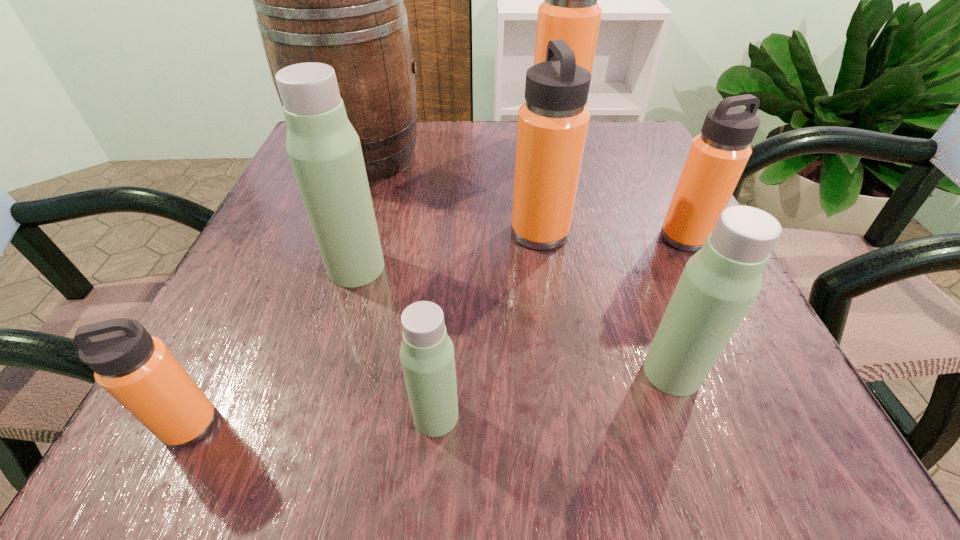
In the image, there is a desktop. At what (x,y) coordinates should I click in order to perform the action: click on free space at the right edge. Please return your answer as a coordinate pair (x, y). The width and height of the screenshot is (960, 540). Looking at the image, I should click on (660, 300).

The width and height of the screenshot is (960, 540). What are the coordinates of `free point at the far right corner` in the screenshot? It's located at (604, 168).

The height and width of the screenshot is (540, 960). Identify the location of free point between the farthest orange thermos bottle and the rightmost light thermos bottle. (613, 254).

Image resolution: width=960 pixels, height=540 pixels. In order to click on free spot between the cider and the third smallest orange thermos bottle in this screenshot , I will do `click(451, 195)`.

Locate an element on the screen. This screenshot has height=540, width=960. free space between the farthest light thermos bottle and the biggest orange thermos bottle is located at coordinates (455, 202).

The width and height of the screenshot is (960, 540). In order to click on free spot between the third smallest orange thermos bottle and the nearest orange thermos bottle in this screenshot , I will do `click(365, 329)`.

This screenshot has height=540, width=960. In order to click on free spot between the rightmost orange thermos bottle and the second biggest orange thermos bottle in this screenshot , I will do `click(612, 235)`.

Find the location of a particular element. free spot between the rightmost orange thermos bottle and the biggest orange thermos bottle is located at coordinates (619, 187).

This screenshot has width=960, height=540. What are the coordinates of `the fifth closest object relative to the second light thermos bottle from left to right` in the screenshot? It's located at [x=717, y=157].

This screenshot has height=540, width=960. Find the location of `the third closest object to the leftmost thermos bottle`. the third closest object to the leftmost thermos bottle is located at coordinates (338, 0).